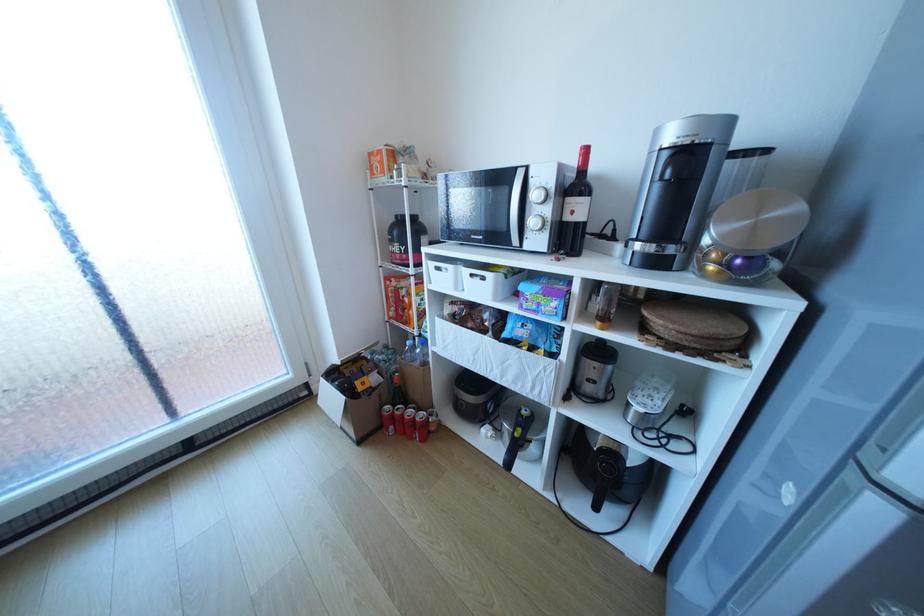
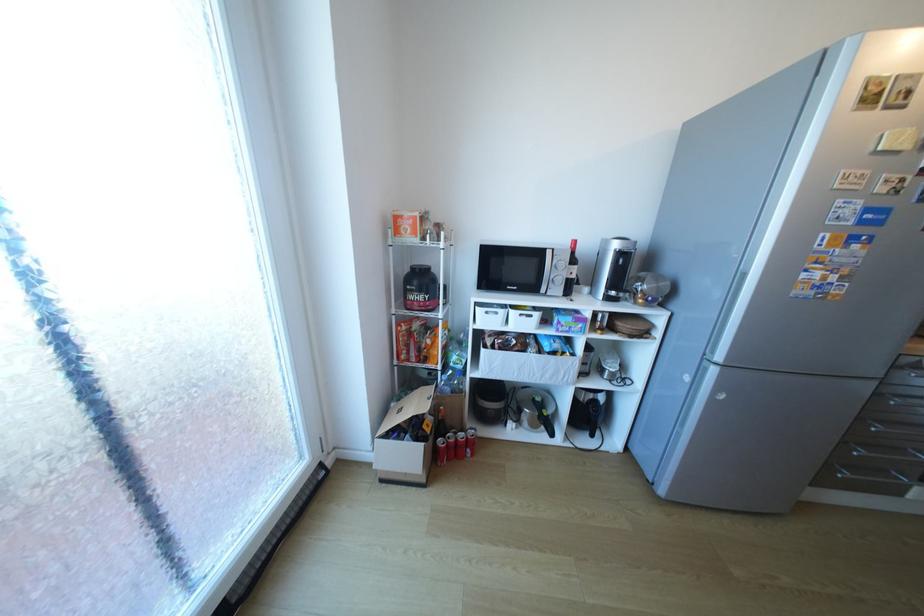
Where in the second image is the point corresponding to pixel 492 278 from the first image?

(540, 315)